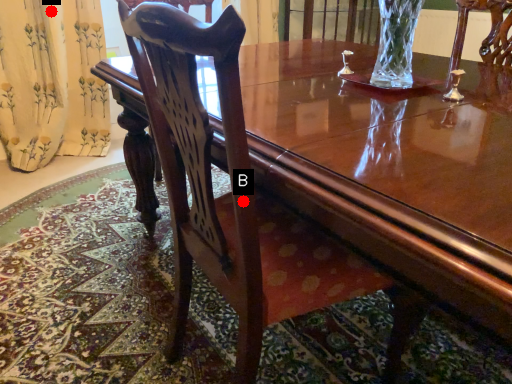
Question: Two points are circled on the image, labeled by A and B beside each circle. Which point is closer to the camera taking this photo?

Choices:
 (A) A is closer
 (B) B is closer

Answer: (B)